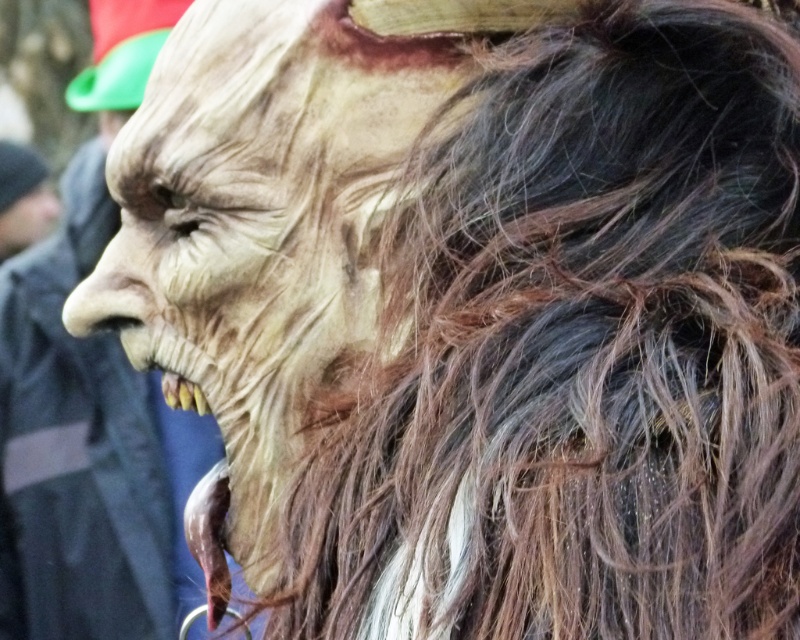
Does matte plastic mask at center appear on the right side of matte black face at left?

Indeed, matte plastic mask at center is positioned on the right side of matte black face at left.

Measure the distance between matte plastic mask at center and matte black face at left.

matte plastic mask at center is 2.76 meters away from matte black face at left.

Is point (393, 51) farther from viewer compared to point (29, 236)?

No, (393, 51) is in front of (29, 236).

Where is `matte plastic mask at center`? This screenshot has width=800, height=640. matte plastic mask at center is located at coordinates (258, 225).

Is matte plastic mask at center positioned at the back of matte plastic mask at left?

No, it is in front of matte plastic mask at left.

Does matte plastic mask at center have a greater width compared to matte plastic mask at left?

No, matte plastic mask at center is not wider than matte plastic mask at left.

Between point (260, 486) and point (106, 65), which one is positioned behind?

The point (106, 65) is more distant.

Image resolution: width=800 pixels, height=640 pixels. What are the coordinates of `matte plastic mask at center` in the screenshot? It's located at (258, 225).

Is matte plastic mask at left behind matte black face at left?

No, matte plastic mask at left is in front of matte black face at left.

Does matte plastic mask at left appear over matte black face at left?

No.

Describe the element at coordinates (90, 403) in the screenshot. This screenshot has height=640, width=800. I see `matte plastic mask at left` at that location.

Find the location of a particular element. The height and width of the screenshot is (640, 800). matte plastic mask at left is located at coordinates (90, 403).